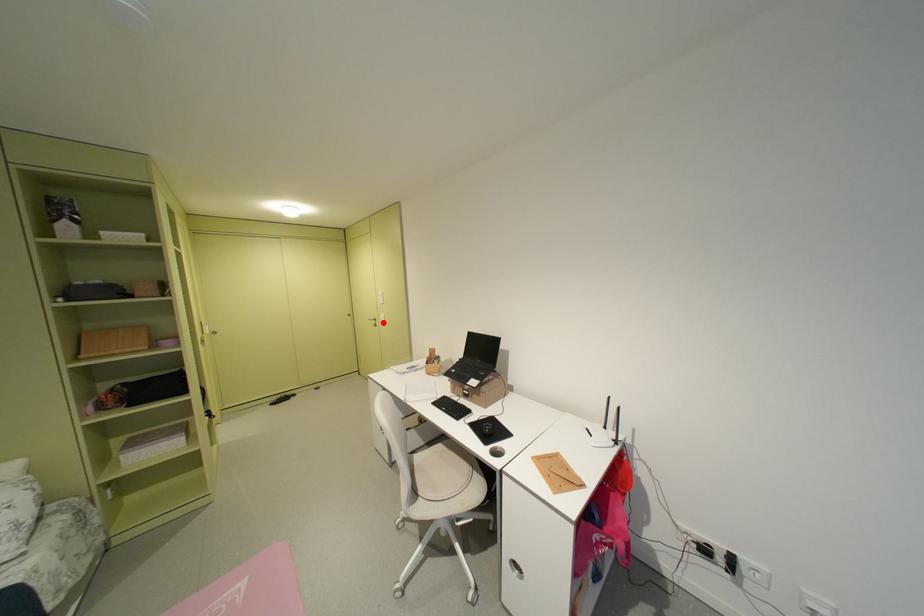
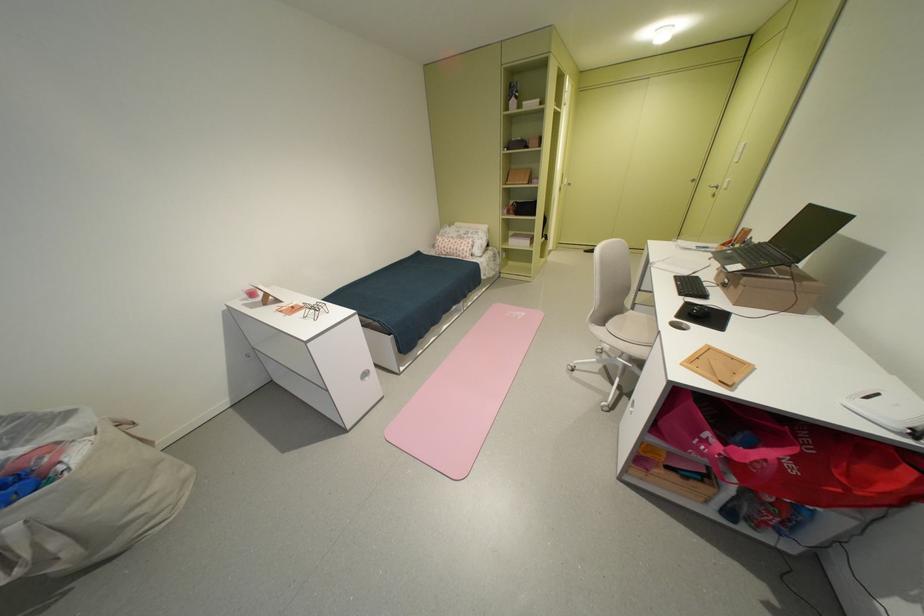
Question: I am providing you with two images of the same scene from different viewpoints. A red point is marked on the first image. Can you still see the location of the red point in image 2?

Choices:
 (A) Yes
 (B) No

Answer: (A)